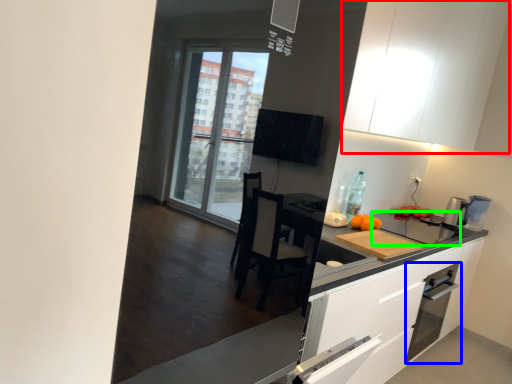
Question: Estimate the real-world distances between objects in this image. Which object is farther from cabinetry (highlighted by a red box), kitchen appliance (highlighted by a blue box) or appliance (highlighted by a green box)?

Choices:
 (A) kitchen appliance
 (B) appliance

Answer: (A)